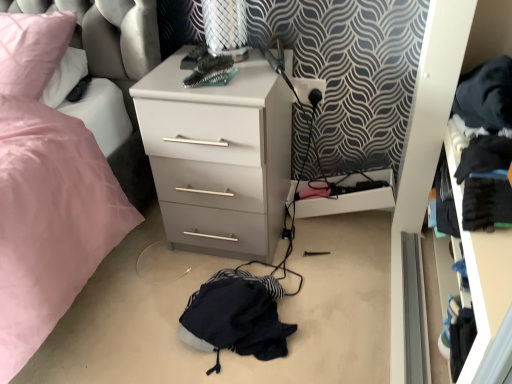
You are a GUI agent. You are given a task and a screenshot of the screen. Output one action in this format:
    pyautogui.click(x=<x>, y=<y>)
    Task: Click on the blank area to the left of dark blue fabric at center
    The image size is (512, 384).
    Given the screenshot: What is the action you would take?
    pyautogui.click(x=133, y=314)